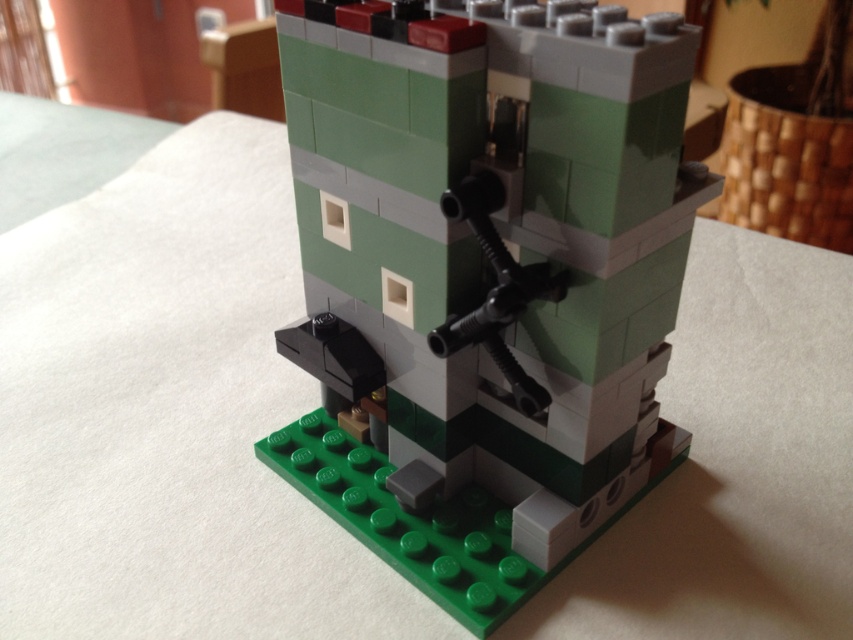
Between point (476, 204) and point (477, 202), which one is positioned behind?

Point (477, 202)

Which is more to the right, green matte tower at center or black plastic gun at center?

black plastic gun at center is more to the right.

Does point (416, 392) lie in front of point (483, 200)?

No, it is behind (483, 200).

Find the location of `green matte tower at center`. green matte tower at center is located at coordinates (485, 276).